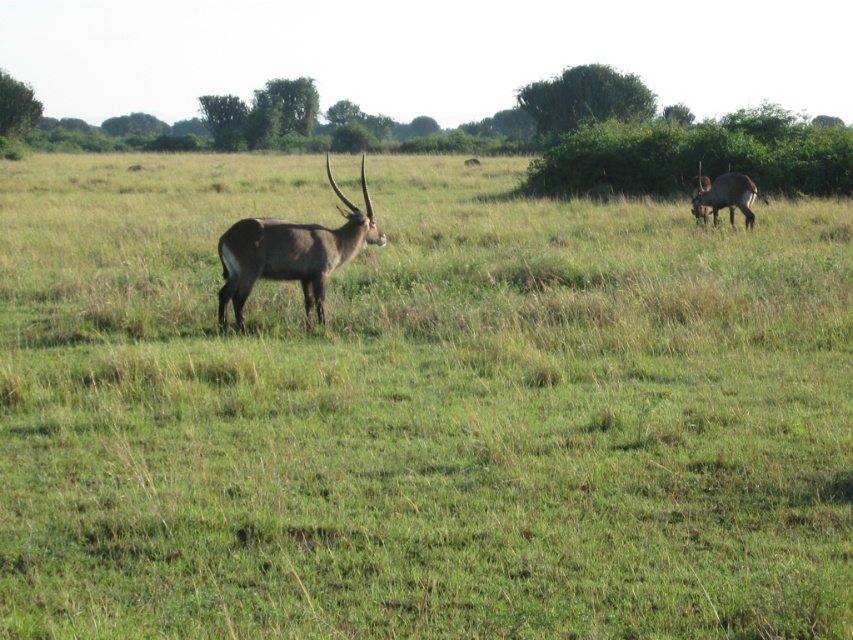
Is point (241, 323) positioned in front of point (744, 186)?

Yes, point (241, 323) is closer to viewer.

Is point (274, 225) in front of point (738, 196)?

That is True.

This screenshot has width=853, height=640. Find the location of `brown glossy antelope at center`. brown glossy antelope at center is located at coordinates (291, 252).